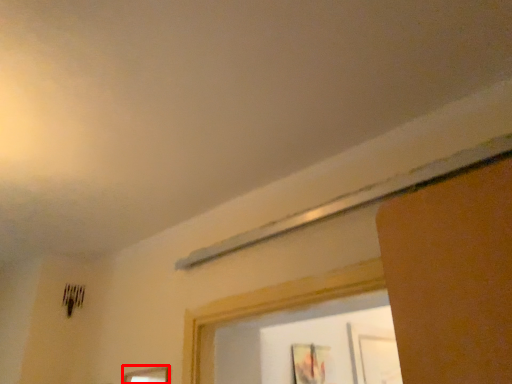
Question: From the image's perspective, considering the relative positions of picture frame (annotated by the red box) and picture frame in the image provided, where is picture frame (annotated by the red box) located with respect to the staircase?

Choices:
 (A) above
 (B) below

Answer: (A)